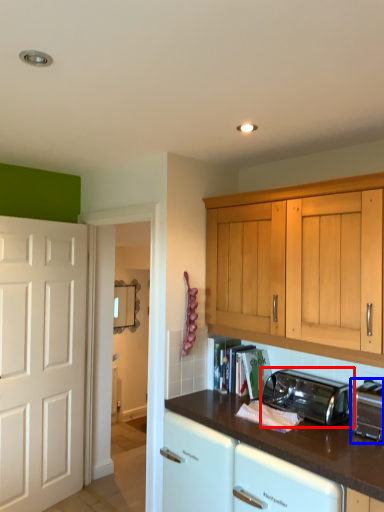
Question: Which object appears farthest to the camera in this image, toaster (highlighted by a red box) or toaster (highlighted by a blue box)?

Choices:
 (A) toaster
 (B) toaster

Answer: (A)